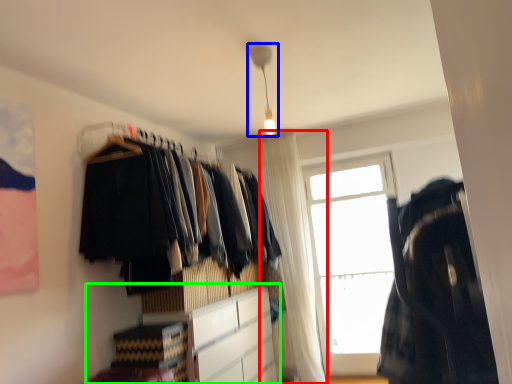
Question: Based on their relative distances, which object is nearer to curtain (highlighted by a red box)? Choose from light fixture (highlighted by a blue box) and cabinetry (highlighted by a green box).

Choices:
 (A) light fixture
 (B) cabinetry

Answer: (B)